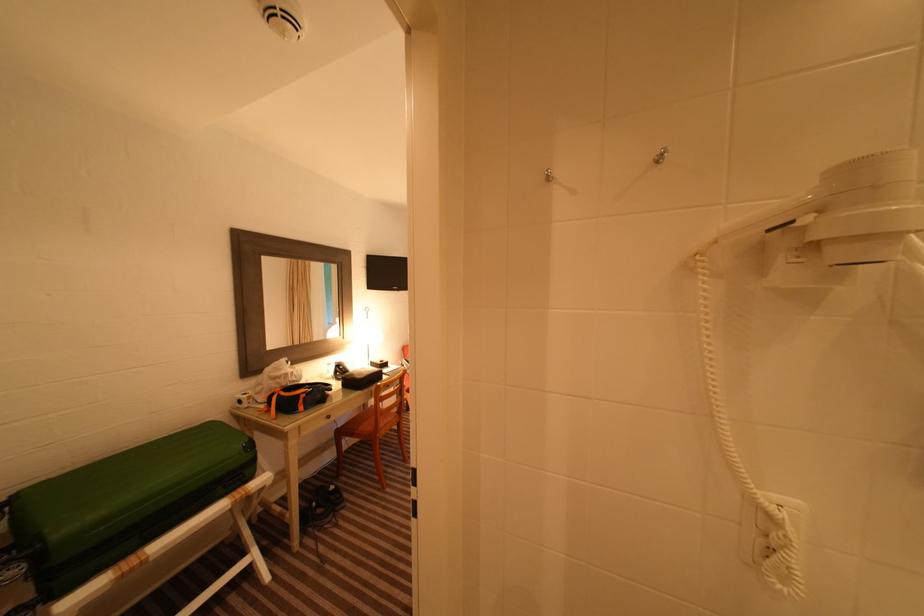
Locate an element on the screen. This screenshot has width=924, height=616. hairdryer handle is located at coordinates (772, 216).